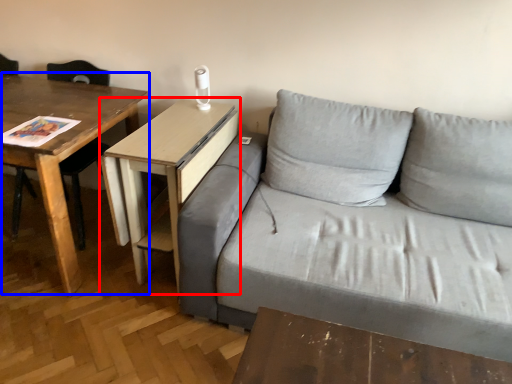
Question: Among these objects, which one is nearest to the camera, table (highlighted by a red box) or table (highlighted by a blue box)?

Choices:
 (A) table
 (B) table

Answer: (B)